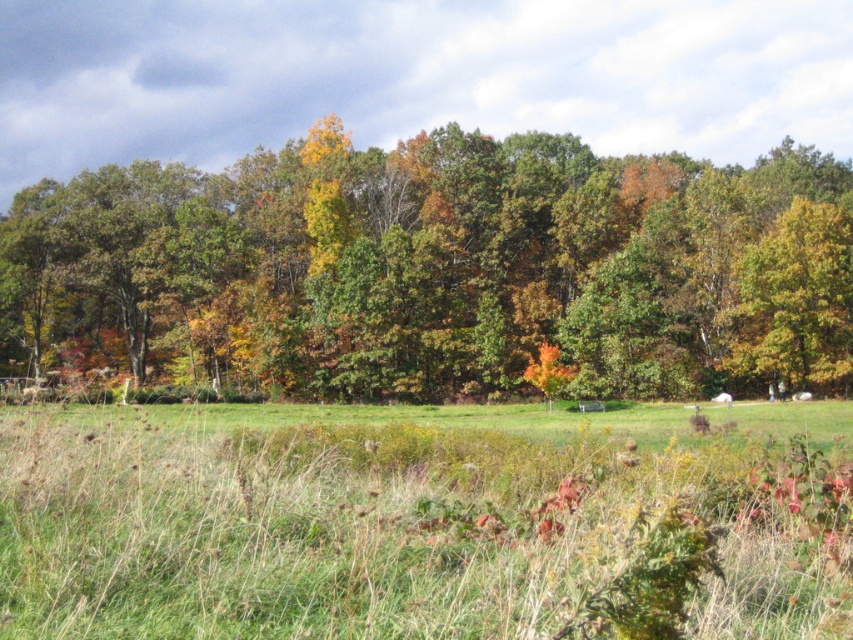
Question: Can you confirm if green matte tree at upper center is thinner than green grass at center?

Choices:
 (A) yes
 (B) no

Answer: (B)

Question: Which point appears farthest from the camera in this image?

Choices:
 (A) (30, 429)
 (B) (315, 246)

Answer: (B)

Question: Can you confirm if green matte tree at upper center is smaller than green grass at center?

Choices:
 (A) yes
 (B) no

Answer: (B)

Question: Is green matte tree at upper center to the right of green grass at center from the viewer's perspective?

Choices:
 (A) yes
 (B) no

Answer: (B)

Question: Which of the following is the farthest from the observer?

Choices:
 (A) green grass at center
 (B) green matte tree at upper center

Answer: (B)

Question: Which point is closer to the camera?

Choices:
 (A) (727, 445)
 (B) (119, 260)

Answer: (A)